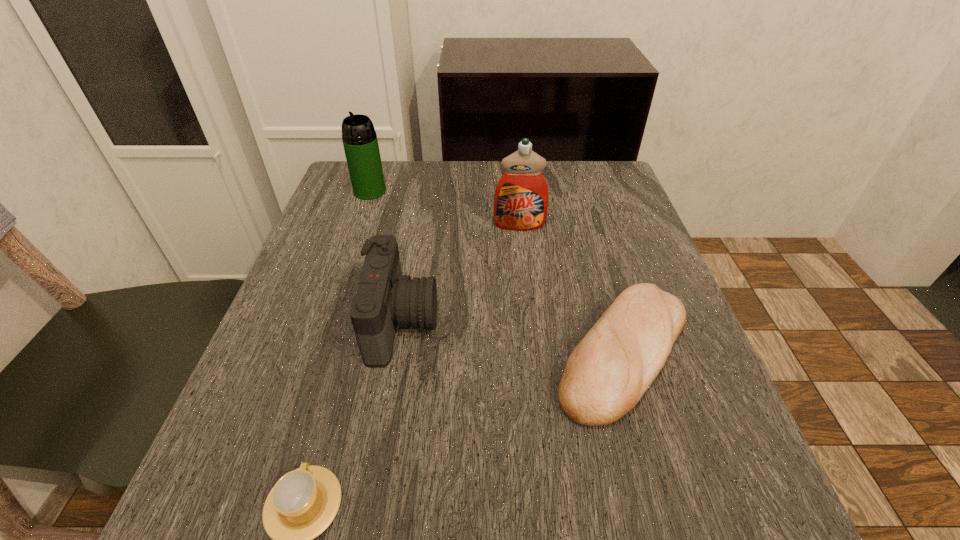
Find the location of a particular element. free space between the detergent and the second shortest object is located at coordinates (571, 289).

Find the location of a particular element. The width and height of the screenshot is (960, 540). vacant space that is in between the bread and the detergent is located at coordinates (571, 289).

Locate an element on the screen. This screenshot has width=960, height=540. free space between the fourth tallest object and the thermos bottle is located at coordinates (496, 272).

Find the location of a particular element. This screenshot has width=960, height=540. unoccupied area between the farthest object and the detergent is located at coordinates (444, 208).

The height and width of the screenshot is (540, 960). In order to click on empty space that is in between the detergent and the farthest object in this screenshot , I will do `click(444, 208)`.

Identify the location of object that can be found as the closest to the second shortest object. The width and height of the screenshot is (960, 540). (521, 198).

Identify the location of the closest object to the second shortest object. This screenshot has width=960, height=540. (521, 198).

The width and height of the screenshot is (960, 540). Find the location of `free space that satisfies the following two spatial constraints: 1. from the spout of the bread; 2. on the left side of the thermos bottle`. free space that satisfies the following two spatial constraints: 1. from the spout of the bread; 2. on the left side of the thermos bottle is located at coordinates (316, 353).

What are the coordinates of `blank space that satisfies the following two spatial constraints: 1. at the lens of the fourth tallest object; 2. on the right side of the third shortest object` in the screenshot? It's located at (396, 353).

The width and height of the screenshot is (960, 540). Identify the location of free spot that satisfies the following two spatial constraints: 1. on the front surface of the detergent; 2. at the lens of the camera. (530, 322).